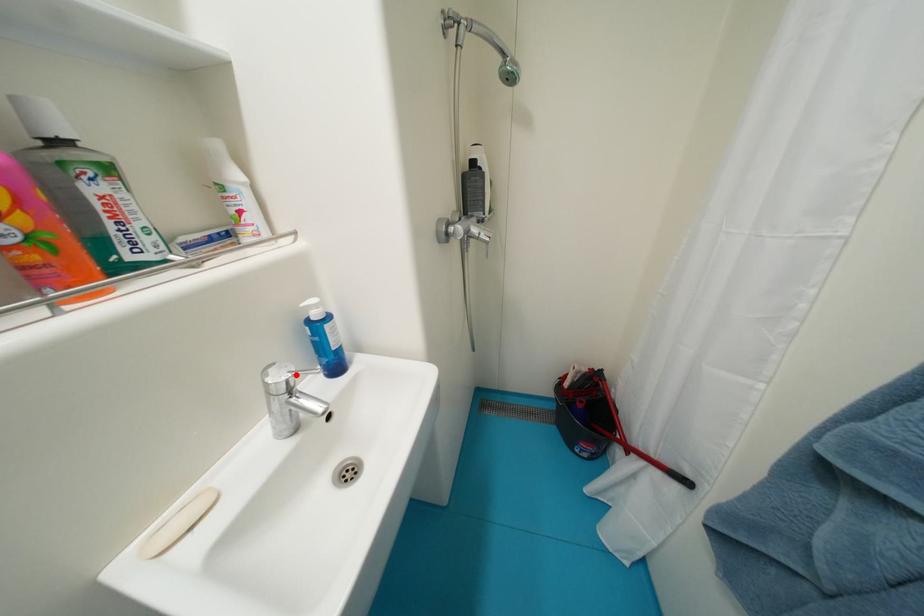
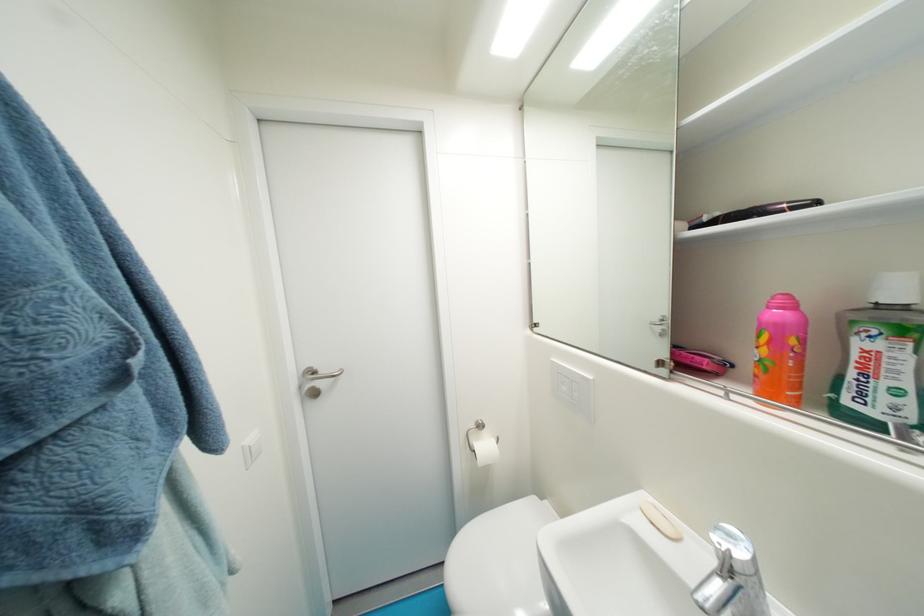
Locate, in the second image, the point that corresponds to the highlighted location in the first image.

(736, 553)